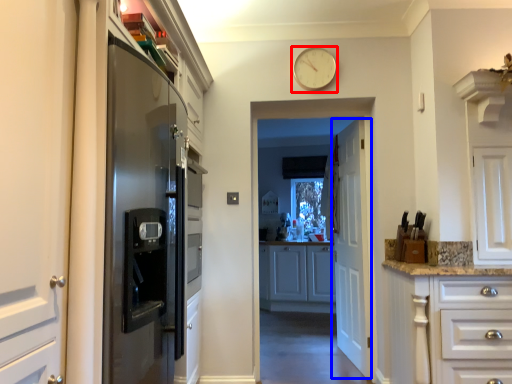
Question: Which object is further to the camera taking this photo, clock (highlighted by a red box) or door (highlighted by a blue box)?

Choices:
 (A) clock
 (B) door

Answer: (B)